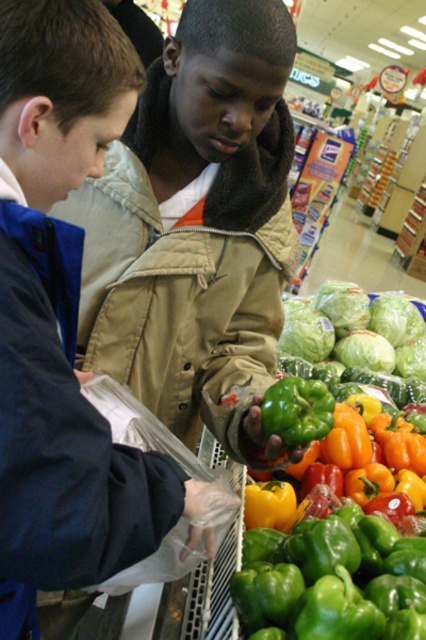
Question: Can you confirm if matte black jacket at left is positioned above green matte bell pepper at center?

Choices:
 (A) no
 (B) yes

Answer: (B)

Question: Which object appears farthest from the camera in this image?

Choices:
 (A) matte black jacket at left
 (B) green matte bell pepper at center
 (C) matte khaki jacket at center

Answer: (C)

Question: Among these points, which one is farthest from the camera?

Choices:
 (A) (345, 570)
 (B) (20, 161)

Answer: (A)

Question: Is matte khaki jacket at center positioned behind green matte bell pepper at center?

Choices:
 (A) no
 (B) yes

Answer: (B)

Question: Which object is farther from the camera taking this photo?

Choices:
 (A) matte khaki jacket at center
 (B) matte black jacket at left

Answer: (A)

Question: Is matte black jacket at left closer to the viewer compared to green matte bell pepper at center?

Choices:
 (A) yes
 (B) no

Answer: (A)